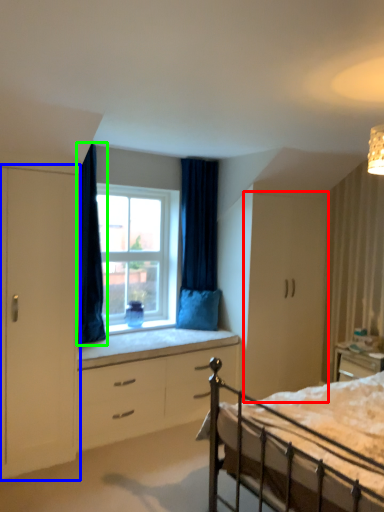
Question: Considering the real-world distances, which object is closest to cabinetry (highlighted by a red box)? armoire (highlighted by a blue box) or curtain (highlighted by a green box).

Choices:
 (A) armoire
 (B) curtain

Answer: (B)